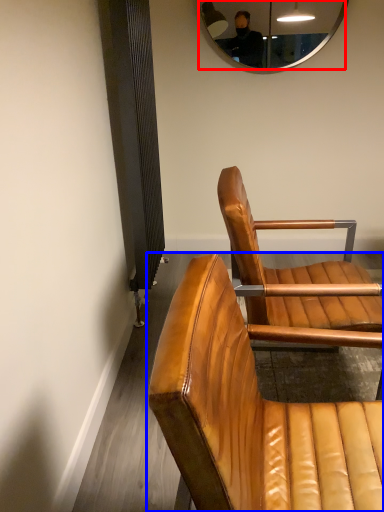
Question: Which point is closer to the camera, mirror (highlighted by a red box) or chair (highlighted by a blue box)?

Choices:
 (A) mirror
 (B) chair

Answer: (B)